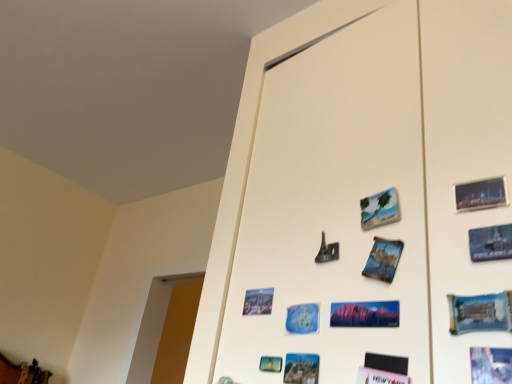
This screenshot has width=512, height=384. What do you see at coordinates (383, 259) in the screenshot? I see `blue paper postcard at center, the fifth postcard positioned from the left` at bounding box center [383, 259].

Looking at this image, measure the distance between point (382, 253) and camera.

The depth of point (382, 253) is 28.07 inches.

Measure the distance between blue glossy postcard at lower right, which ranks as the 7th postcard in left-to-right order, and camera.

A distance of 21.81 inches exists between blue glossy postcard at lower right, which ranks as the 7th postcard in left-to-right order, and camera.

Measure the distance between metallic silver eiffel tower at center and camera.

metallic silver eiffel tower at center and camera are 30.83 inches apart from each other.

Measure the distance between blue paper postcard at lower center, placed as the 7th postcard when sorted from right to left, and camera.

27.74 inches.

At what (x,y) coordinates should I click in order to perform the action: click on blue paper postcard at center, acting as the 4th postcard starting from the right. Please return your answer as a coordinate pair (x, y). The width and height of the screenshot is (512, 384). Looking at the image, I should click on (383, 259).

From a real-world perspective, is metallic silver eiffel tower at center above or below blue paper postcard at center, acting as the 4th postcard starting from the right?

metallic silver eiffel tower at center is situated higher than blue paper postcard at center, acting as the 4th postcard starting from the right, in the real world.

Considering the sizes of objects metallic silver eiffel tower at center and blue paper postcard at center, the fifth postcard positioned from the left, in the image provided, who is wider, metallic silver eiffel tower at center or blue paper postcard at center, the fifth postcard positioned from the left,?

With larger width is blue paper postcard at center, the fifth postcard positioned from the left.

Which is behind, point (321, 262) or point (392, 268)?

The point (321, 262) is farther.

Which point is more forward, (301,354) or (270,306)?

The point (301,354) is in front.

Based on the photo, in terms of height, does blue paper postcard at lower center, placed as the 7th postcard when sorted from right to left, look taller or shorter compared to matte paper postcard at lower center, arranged as the 1th postcard when viewed from the left?

In the image, blue paper postcard at lower center, placed as the 7th postcard when sorted from right to left, appears to be shorter than matte paper postcard at lower center, arranged as the 1th postcard when viewed from the left.

Which object is closer to the camera, blue paper postcard at lower center, which appears as the second postcard when viewed from the left, or matte paper postcard at lower center, arranged as the 1th postcard when viewed from the left?

blue paper postcard at lower center, which appears as the second postcard when viewed from the left, is more forward.

From a real-world perspective, is blue paper postcard at lower center, which appears as the second postcard when viewed from the left, located higher than matte paper postcard at lower center, arranged as the 1th postcard when viewed from the left?

No, from a real-world perspective, blue paper postcard at lower center, which appears as the second postcard when viewed from the left, is not on top of matte paper postcard at lower center, arranged as the 1th postcard when viewed from the left.

The image size is (512, 384). I want to click on art behind the blue paper postcard at center, the third postcard positioned from the left, so click(x=327, y=251).

Are metallic silver eiffel tower at center and blue paper postcard at center, marked as the sixth postcard in a right-to-left arrangement, making contact?

metallic silver eiffel tower at center is not next to blue paper postcard at center, marked as the sixth postcard in a right-to-left arrangement, and they're not touching.

Does metallic silver eiffel tower at center come in front of blue paper postcard at center, the third postcard positioned from the left?

No, metallic silver eiffel tower at center is further to the viewer.

Is point (334, 248) positioned after point (298, 308)?

That is False.

Can we say matte paper postcard at lower center, positioned as the eighth postcard in right-to-left order, lies outside blue paper postcard at center, acting as the 4th postcard starting from the right?

Yes, matte paper postcard at lower center, positioned as the eighth postcard in right-to-left order, is located beyond the bounds of blue paper postcard at center, acting as the 4th postcard starting from the right.

Is matte paper postcard at lower center, positioned as the eighth postcard in right-to-left order, oriented away from blue paper postcard at center, acting as the 4th postcard starting from the right?

No, matte paper postcard at lower center, positioned as the eighth postcard in right-to-left order, is not facing away from blue paper postcard at center, acting as the 4th postcard starting from the right.

From the image's perspective, which object appears higher, matte paper postcard at lower center, arranged as the 1th postcard when viewed from the left, or blue paper postcard at center, the fifth postcard positioned from the left?

blue paper postcard at center, the fifth postcard positioned from the left, is shown above in the image.

Which of these two, matte paper postcard at lower center, arranged as the 1th postcard when viewed from the left, or blue paper postcard at center, acting as the 4th postcard starting from the right, stands shorter?

With less height is matte paper postcard at lower center, arranged as the 1th postcard when viewed from the left.

Is metallic silver eiffel tower at center looking in the opposite direction of matte paper postcard at lower center, arranged as the 1th postcard when viewed from the left?

No, metallic silver eiffel tower at center is not facing away from matte paper postcard at lower center, arranged as the 1th postcard when viewed from the left.

In the scene shown: Between metallic silver eiffel tower at center and matte paper postcard at lower center, positioned as the eighth postcard in right-to-left order, which one is positioned in front?

metallic silver eiffel tower at center is closer to the camera.

Looking at this image, can we say metallic silver eiffel tower at center lies outside matte paper postcard at lower center, positioned as the eighth postcard in right-to-left order?

Yes, metallic silver eiffel tower at center is outside of matte paper postcard at lower center, positioned as the eighth postcard in right-to-left order.

Could you measure the distance between metallic silver eiffel tower at center and matte paper postcard at lower center, arranged as the 1th postcard when viewed from the left?

5.94 inches.

From a real-world perspective, is blue paper postcard at center, the third postcard positioned from the left, physically below blue glossy postcard at lower right, the second postcard positioned from the right?

Yes, from a real-world perspective, blue paper postcard at center, the third postcard positioned from the left, is below blue glossy postcard at lower right, the second postcard positioned from the right.

Between blue paper postcard at center, marked as the sixth postcard in a right-to-left arrangement, and blue glossy postcard at lower right, the second postcard positioned from the right, which one has more height?

With more height is blue glossy postcard at lower right, the second postcard positioned from the right.

Is blue paper postcard at center, the third postcard positioned from the left, situated inside blue glossy postcard at lower right, which ranks as the 7th postcard in left-to-right order, or outside?

blue paper postcard at center, the third postcard positioned from the left, is outside blue glossy postcard at lower right, which ranks as the 7th postcard in left-to-right order.

In the image, is blue paper postcard at center, the third postcard positioned from the left, positioned in front of or behind blue glossy postcard at lower right, which ranks as the 7th postcard in left-to-right order?

Clearly, blue paper postcard at center, the third postcard positioned from the left, is behind blue glossy postcard at lower right, which ranks as the 7th postcard in left-to-right order.

From the image's perspective, which is above, metallic gold jewelry at lower left or blue paper postcard at lower center, which appears as the second postcard when viewed from the left?

blue paper postcard at lower center, which appears as the second postcard when viewed from the left.

Can you tell me how much metallic gold jewelry at lower left and blue paper postcard at lower center, which appears as the second postcard when viewed from the left, differ in facing direction?

The angle between the facing direction of metallic gold jewelry at lower left and the facing direction of blue paper postcard at lower center, which appears as the second postcard when viewed from the left, is 96.4 degrees.

Identify the location of the 1st postcard above the metallic gold jewelry at lower left (from a real-world perspective). (301, 368).

Based on the photo, from a real-world perspective, is metallic gold jewelry at lower left physically above blue paper postcard at lower center, placed as the 7th postcard when sorted from right to left?

Incorrect, from a real-world perspective, metallic gold jewelry at lower left is lower than blue paper postcard at lower center, placed as the 7th postcard when sorted from right to left.

Where is `the 2nd postcard counting from the right side of the metallic silver eiffel tower at center`? the 2nd postcard counting from the right side of the metallic silver eiffel tower at center is located at coordinates [x=383, y=259].

At what (x,y) coordinates should I click in order to perform the action: click on postcard located on the left of blue paper postcard at lower center, placed as the 7th postcard when sorted from right to left. Please return your answer as a coordinate pair (x, y). The height and width of the screenshot is (384, 512). Looking at the image, I should click on (258, 301).

Based on their spatial positions, is blue paper postcard at lower right, the 8th postcard from the left, or blue paper postcard at center, marked as the sixth postcard in a right-to-left arrangement, further from matte paper postcard at lower center, positioned as the eighth postcard in right-to-left order?

blue paper postcard at lower right, the 8th postcard from the left, is further to matte paper postcard at lower center, positioned as the eighth postcard in right-to-left order.

Looking at this image, considering their positions, is blue paper postcard at center, acting as the 4th postcard starting from the right, positioned closer to beige matte postcard at upper center, arranged as the sixth postcard when viewed from the left, than blue glossy postcard at lower right, the second postcard positioned from the right?

blue paper postcard at center, acting as the 4th postcard starting from the right.

Estimate the real-world distances between objects in this image. Which object is closer to matte red rock formation at center, the fourth postcard in the left-to-right sequence, beige matte postcard at upper center, which is the third postcard in right-to-left order, or matte paper postcard at lower center, positioned as the eighth postcard in right-to-left order?

beige matte postcard at upper center, which is the third postcard in right-to-left order, is positioned closer to the anchor matte red rock formation at center, the fourth postcard in the left-to-right sequence.

Looking at the image, which one is located further to blue glossy postcard at lower right, the second postcard positioned from the right, blue paper postcard at center, the fifth postcard positioned from the left, or metallic silver eiffel tower at center?

metallic silver eiffel tower at center is positioned further to the anchor blue glossy postcard at lower right, the second postcard positioned from the right.

Looking at the image, which one is located closer to blue glossy postcard at lower right, the second postcard positioned from the right, matte red rock formation at center, the 5th postcard when ordered from right to left, or blue paper postcard at lower right, the 8th postcard from the left?

Based on the image, blue paper postcard at lower right, the 8th postcard from the left, appears to be nearer to blue glossy postcard at lower right, the second postcard positioned from the right.

Estimate the real-world distances between objects in this image. Which object is further from blue paper postcard at center, marked as the sixth postcard in a right-to-left arrangement, matte paper postcard at lower center, arranged as the 1th postcard when viewed from the left, or metallic gold jewelry at lower left?

Among the two, metallic gold jewelry at lower left is located further to blue paper postcard at center, marked as the sixth postcard in a right-to-left arrangement.

From the image, which object appears to be farther from blue paper postcard at center, the fifth postcard positioned from the left, metallic gold jewelry at lower left or blue glossy postcard at lower right, which ranks as the 7th postcard in left-to-right order?

Based on the image, metallic gold jewelry at lower left appears to be further to blue paper postcard at center, the fifth postcard positioned from the left.

When comparing their distances from blue paper postcard at center, the fifth postcard positioned from the left, does blue paper postcard at lower center, which appears as the second postcard when viewed from the left, or beige matte postcard at upper center, which is the third postcard in right-to-left order, seem further?

blue paper postcard at lower center, which appears as the second postcard when viewed from the left, is further to blue paper postcard at center, the fifth postcard positioned from the left.

Where is `art located between blue glossy postcard at lower right, which ranks as the 7th postcard in left-to-right order, and matte paper postcard at lower center, positioned as the eighth postcard in right-to-left order, in the depth direction`? This screenshot has width=512, height=384. art located between blue glossy postcard at lower right, which ranks as the 7th postcard in left-to-right order, and matte paper postcard at lower center, positioned as the eighth postcard in right-to-left order, in the depth direction is located at coordinates (327, 251).

I want to click on postcard between blue paper postcard at lower right, the 8th postcard from the left, and matte red rock formation at center, the fourth postcard in the left-to-right sequence, in the front-back direction, so [480, 313].

Find the location of a particular element. postcard between metallic silver eiffel tower at center and metallic gold jewelry at lower left from front to back is located at coordinates (258, 301).

I want to click on art located between blue paper postcard at center, acting as the 4th postcard starting from the right, and metallic gold jewelry at lower left in the depth direction, so click(x=327, y=251).